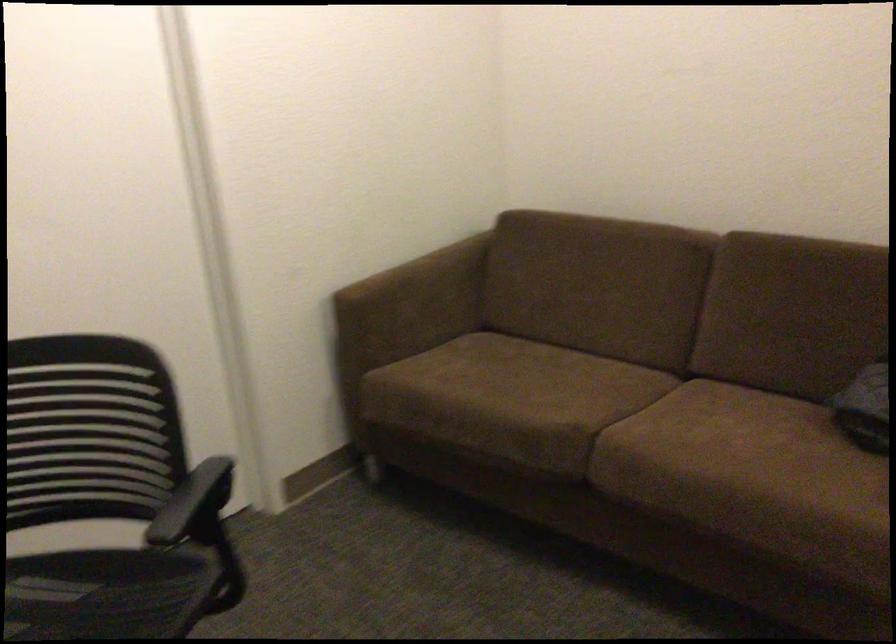
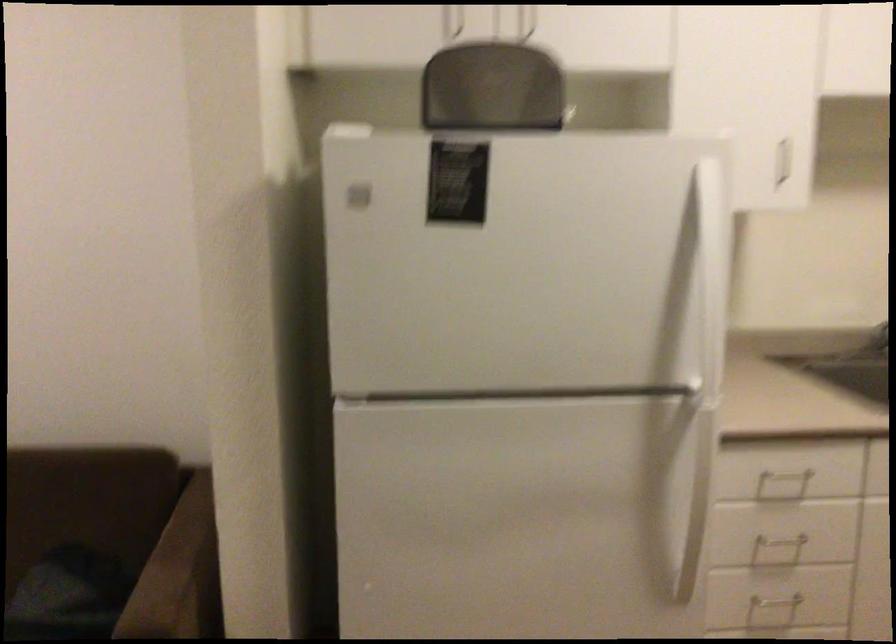
Question: The first image is from the beginning of the video and the second image is from the end. How did the camera likely rotate when shooting the video?

Choices:
 (A) Left
 (B) Right
 (C) Up
 (D) Down

Answer: (B)